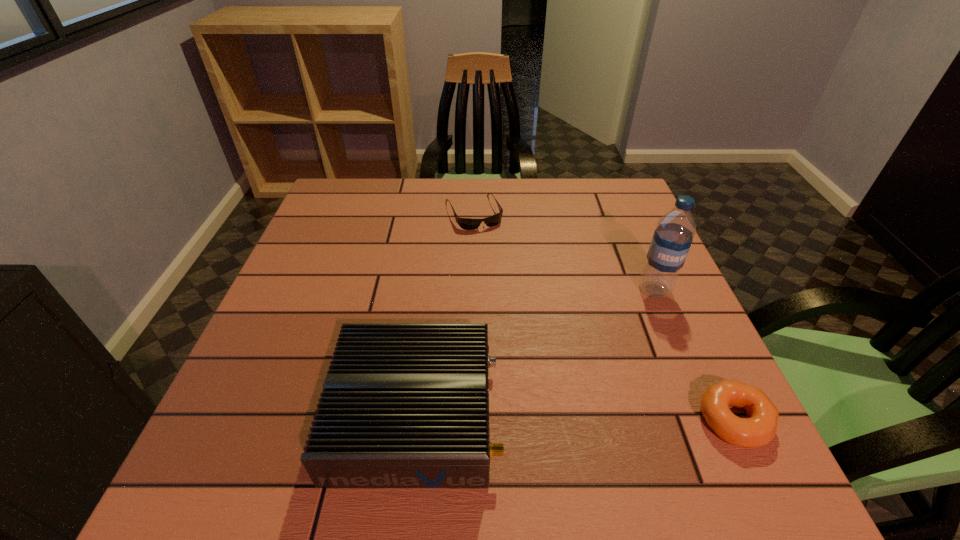
Identify the location of the second tallest object. The width and height of the screenshot is (960, 540). (404, 405).

Find the location of a particular element. Image resolution: width=960 pixels, height=540 pixels. the second shortest object is located at coordinates (758, 430).

Find the location of a particular element. the shortest object is located at coordinates (465, 223).

Image resolution: width=960 pixels, height=540 pixels. I want to click on the farthest object, so click(x=465, y=223).

Find the location of a particular element. water bottle is located at coordinates (673, 236).

At what (x,y) coordinates should I click in order to perform the action: click on the tallest object. Please return your answer as a coordinate pair (x, y). Looking at the image, I should click on coord(673,236).

This screenshot has width=960, height=540. Identify the location of vacant space located 0.250m on the back panel of the second tallest object. (642, 414).

This screenshot has width=960, height=540. I want to click on vacant space located on the back of the doughnut, so click(x=708, y=364).

The height and width of the screenshot is (540, 960). Find the location of `free space located on the front-facing side of the sunglasses`. free space located on the front-facing side of the sunglasses is located at coordinates (504, 275).

In order to click on free location located on the front-facing side of the sunglasses in this screenshot , I will do `click(510, 286)`.